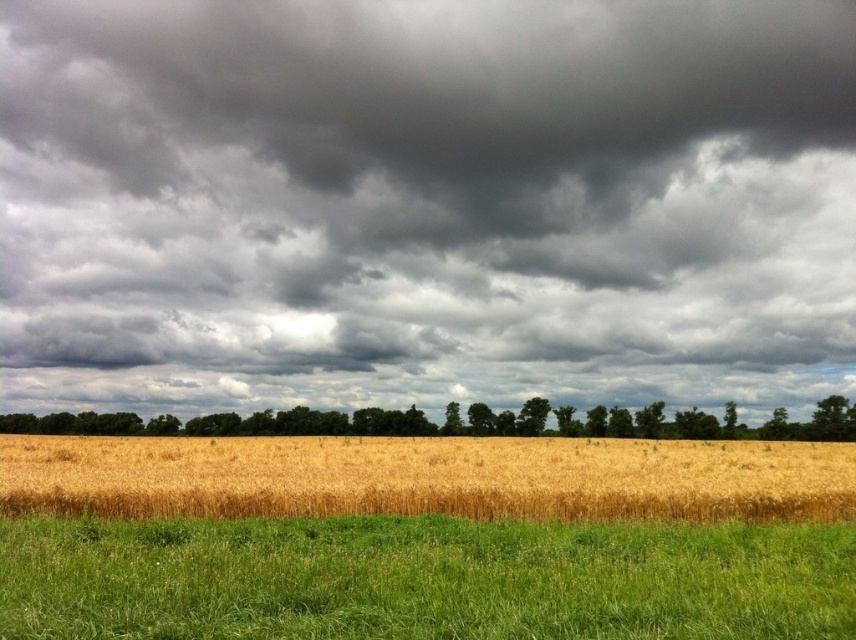
Is green grassy field at lower center below green leafy trees at center?

Incorrect, green grassy field at lower center is not positioned below green leafy trees at center.

Can you confirm if green grassy field at lower center is positioned to the right of green leafy trees at center?

Correct, you'll find green grassy field at lower center to the right of green leafy trees at center.

Is point (290, 612) farther from viewer compared to point (569, 419)?

No, it is not.

The height and width of the screenshot is (640, 856). I want to click on green grassy field at lower center, so click(x=423, y=579).

Does green grassy field at lower center have a greater height compared to golden wheat field at center?

No, green grassy field at lower center is not taller than golden wheat field at center.

Can you confirm if green grassy field at lower center is positioned above golden wheat field at center?

Yes, green grassy field at lower center is above golden wheat field at center.

The image size is (856, 640). I want to click on green grassy field at lower center, so click(423, 579).

Where is `green grassy field at lower center`? The height and width of the screenshot is (640, 856). green grassy field at lower center is located at coordinates (423, 579).

Is dark gray cloud at upper center below green grassy field at lower center?

No, dark gray cloud at upper center is not below green grassy field at lower center.

Can you confirm if dark gray cloud at upper center is positioned above green grassy field at lower center?

Indeed, dark gray cloud at upper center is positioned over green grassy field at lower center.

Where is `dark gray cloud at upper center`? This screenshot has height=640, width=856. dark gray cloud at upper center is located at coordinates (425, 202).